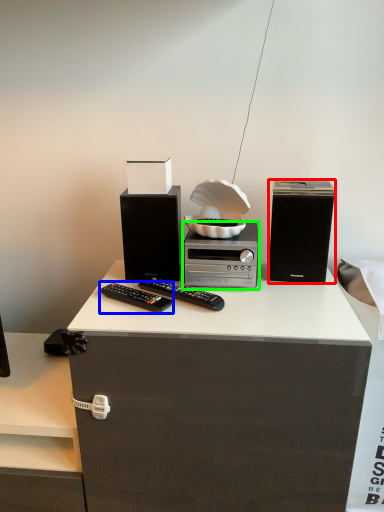
Question: Based on their relative distances, which object is nearer to speaker (highlighted by a red box)? Choose from remote control (highlighted by a blue box) and home appliance (highlighted by a green box).

Choices:
 (A) remote control
 (B) home appliance

Answer: (B)